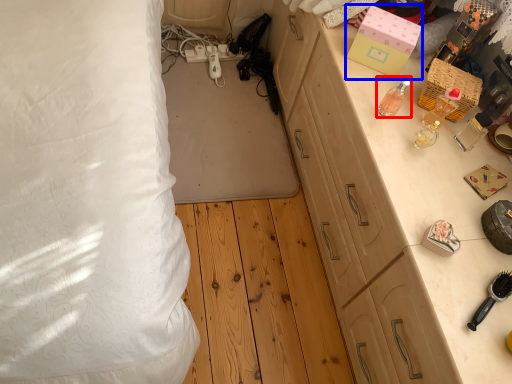
Question: Which point is further to the camera, perfume (highlighted by a red box) or box (highlighted by a blue box)?

Choices:
 (A) perfume
 (B) box

Answer: (B)